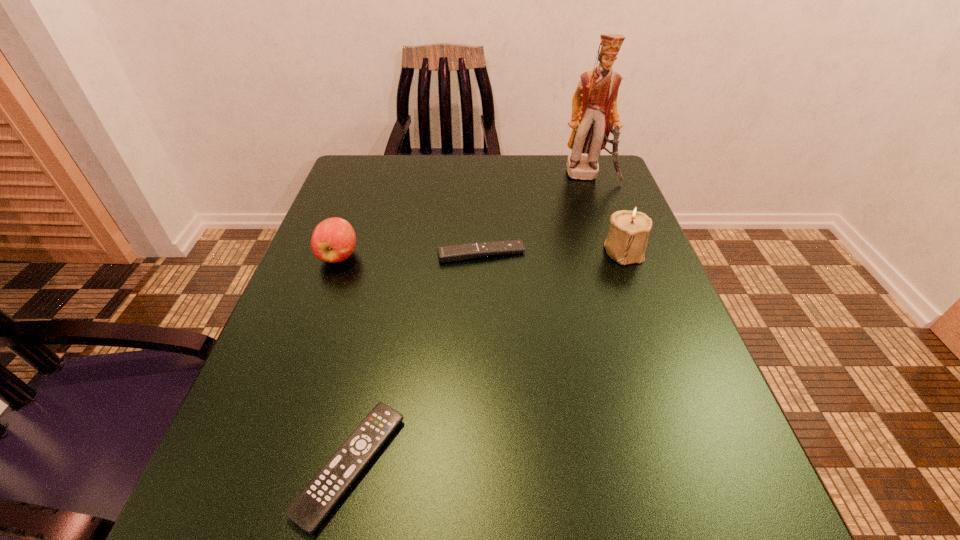
Find the location of `object present at the near left corner`. object present at the near left corner is located at coordinates (309, 509).

You are a GUI agent. You are given a task and a screenshot of the screen. Output one action in this format:
    pyautogui.click(x=<x>, y=<y>)
    Task: Click on the object present at the far right corner
    
    Given the screenshot: What is the action you would take?
    pyautogui.click(x=594, y=104)

Where is `vacant area at the near edge of the desktop`? This screenshot has height=540, width=960. vacant area at the near edge of the desktop is located at coordinates (599, 530).

Where is `blank space at the left edge`? The width and height of the screenshot is (960, 540). blank space at the left edge is located at coordinates (363, 257).

The image size is (960, 540). I want to click on free location at the right edge, so click(596, 265).

In the image, there is a desktop. At what (x,y) coordinates should I click in order to perform the action: click on vacant area at the far left corner. Please return your answer as a coordinate pair (x, y). The height and width of the screenshot is (540, 960). Looking at the image, I should click on (359, 154).

In order to click on free region at the far right corner in this screenshot , I will do `click(607, 160)`.

Image resolution: width=960 pixels, height=540 pixels. What are the coordinates of `free space between the candle_holder and the third object from left to right` in the screenshot? It's located at (552, 252).

The height and width of the screenshot is (540, 960). I want to click on vacant area that lies between the fourth shortest object and the third object from left to right, so click(552, 252).

Locate an element on the screen. The width and height of the screenshot is (960, 540). empty space that is in between the second tallest object and the tallest object is located at coordinates pyautogui.click(x=606, y=213).